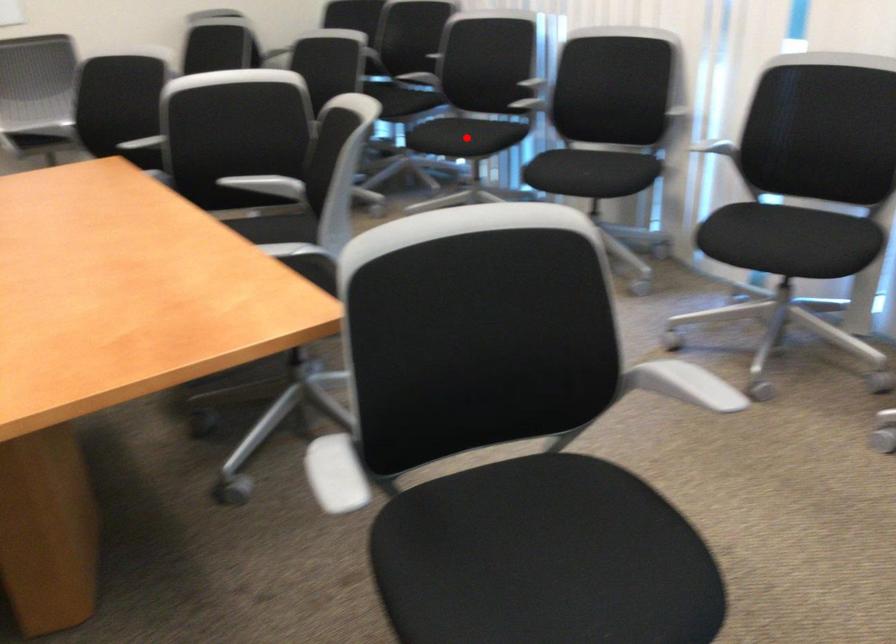
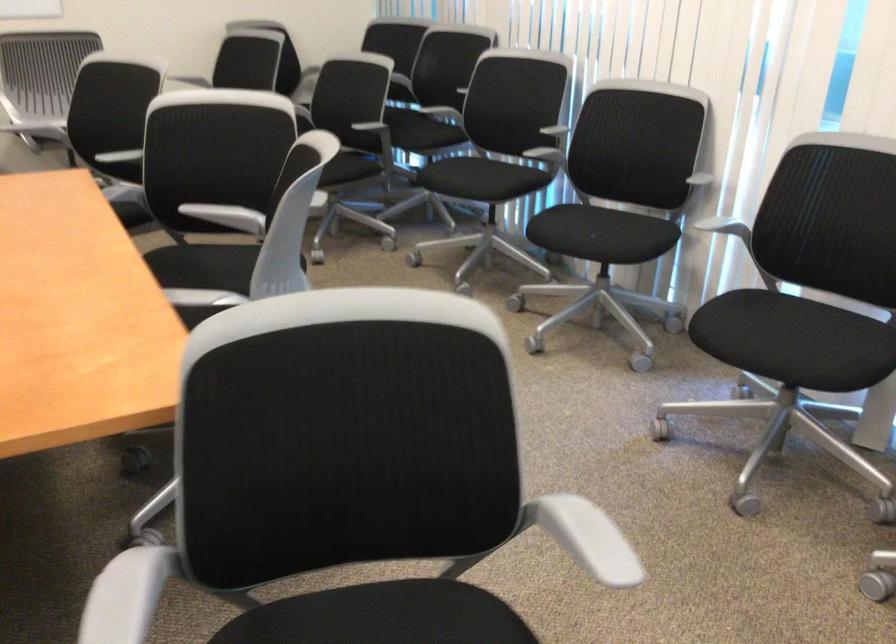
In the second image, find the point that corresponds to the highlighted location in the first image.

(480, 178)